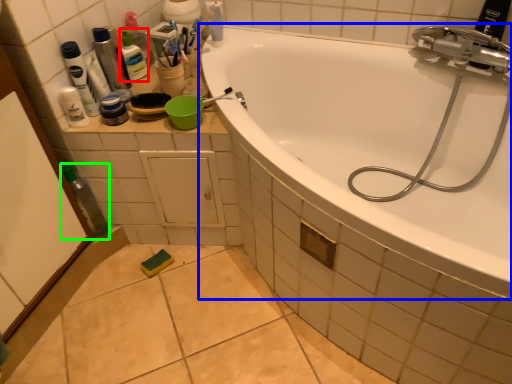
Question: Which object is the farthest from toiletry (highlighted by a red box)? Choose among these: bathtub (highlighted by a blue box) or bottle (highlighted by a green box).

Choices:
 (A) bathtub
 (B) bottle

Answer: (A)